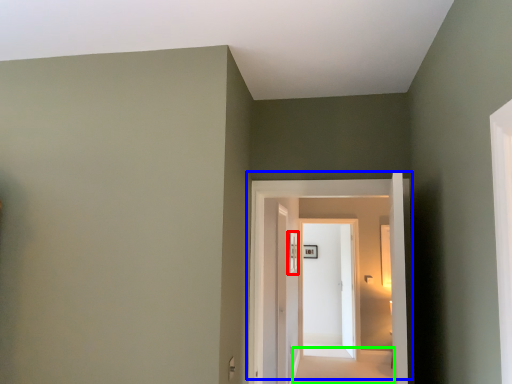
Question: Which object is the closest to the window (highlighted by a red box)? Choose among these: door (highlighted by a blue box) or path (highlighted by a green box).

Choices:
 (A) door
 (B) path

Answer: (A)